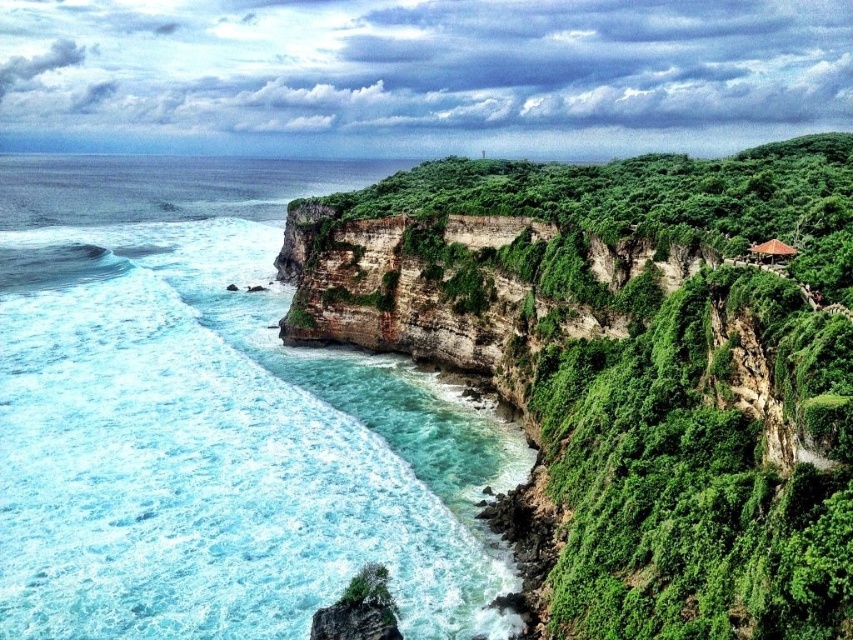
You are standing on the cliff and see the point marked at coordinates (213, 420). Based on the scene description, what is the color and location of the water at that point?

The clear blue water at left is represented by point (213, 420), so the water at that point is clear blue and located on the left side of the image.

You are standing at the base of the cliff looking upward. There are two points marked on the cliff face. The first point is at coordinates point (401, 550) and the second point is at point (749, 252). Which point is closer to you?

Point (749, 252) is closer to you because it is in front of point (401, 550).

You are planning to build a small garden in your backyard. You have two plants, one is green leafy vegetation at center and the other is brown thatched hut at upper right. Which plant would you choose if you want a larger plant for your garden?

The green leafy vegetation at center has a larger size compared to the brown thatched hut at upper right, so you should choose the green leafy vegetation at center for a larger plant in your garden.